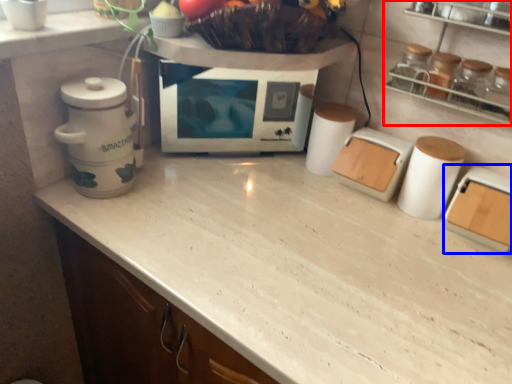
Question: Which of the following is the closest to the observer, shelf (highlighted by a red box) or kitchen appliance (highlighted by a blue box)?

Choices:
 (A) shelf
 (B) kitchen appliance

Answer: (A)